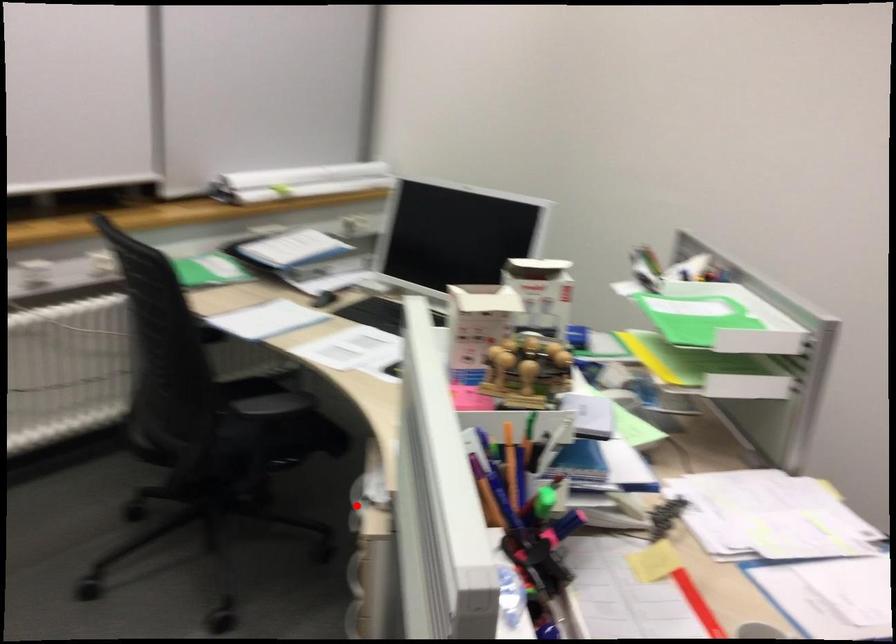
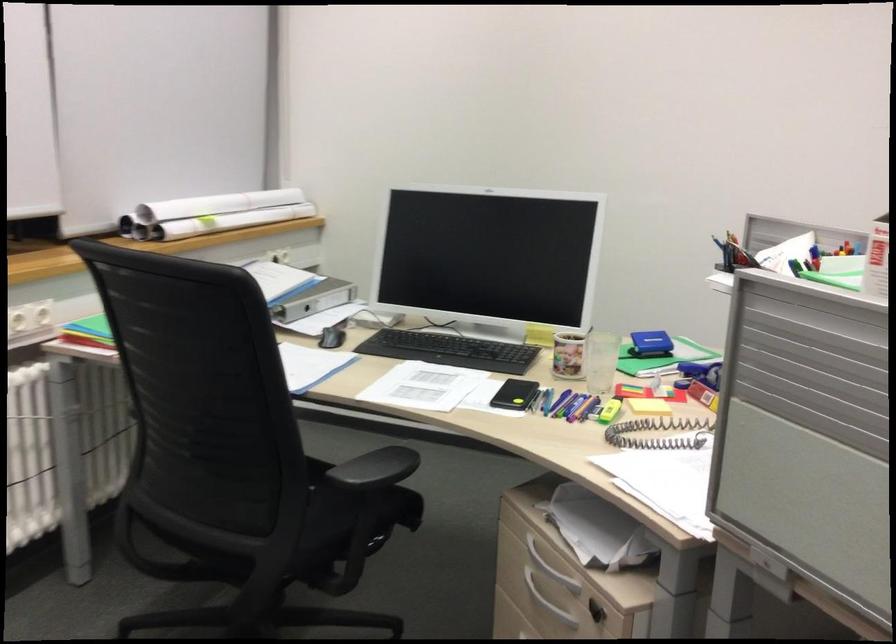
Question: A red point is marked in image1. In image2, is the corresponding 3D point closer to the camera or farther? Reply with the corresponding letter.

Choices:
 (A) The corresponding 3D point is closer.
 (B) The corresponding 3D point is farther.

Answer: (A)